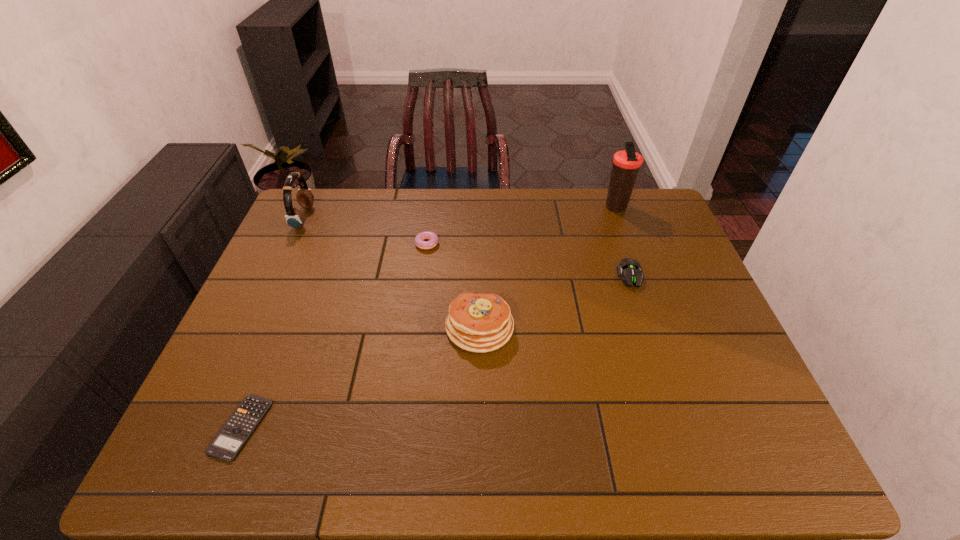
At what (x,y) coordinates should I click in order to perform the action: click on thermos bottle. Please return your answer as a coordinate pair (x, y). Looking at the image, I should click on tap(626, 164).

Locate an element on the screen. This screenshot has height=540, width=960. the fifth shortest object is located at coordinates (294, 217).

The height and width of the screenshot is (540, 960). What are the coordinates of `the third object from right to left` in the screenshot? It's located at click(482, 322).

Find the location of a particular element. The height and width of the screenshot is (540, 960). pancake is located at coordinates (482, 322).

Identify the location of doughnut. (426, 235).

This screenshot has width=960, height=540. I want to click on the third object from left to right, so click(x=426, y=235).

Image resolution: width=960 pixels, height=540 pixels. What are the coordinates of `the fourth farthest object` in the screenshot? It's located at (630, 270).

What are the coordinates of `calculator` in the screenshot? It's located at (227, 444).

Image resolution: width=960 pixels, height=540 pixels. I want to click on the nearest object, so click(x=227, y=444).

The width and height of the screenshot is (960, 540). I want to click on vacant space located 0.060m on the back of the tallest object, so click(x=608, y=189).